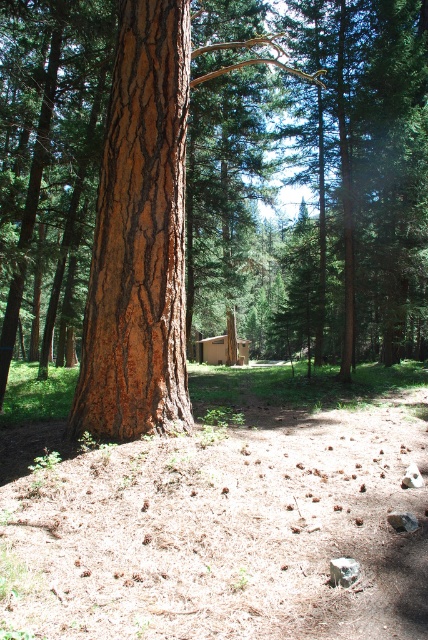
You are planning to build a small garden between the brown rough bark tree at center and the brown wooden cabin at center. Considering their sizes, which one will require more space to accommodate its base?

The brown rough bark tree at center is larger in size than the brown wooden cabin at center, so it will require more space to accommodate its base.

You are planning to build a small garden between the brown rough bark tree at center and the brown wooden cabin at center. Given that the tree is wider than the cabin, which object would require more space when placing garden elements around it?

The brown rough bark tree at center requires more space when placing garden elements around it because its width is larger than the brown wooden cabin at center.

You are planning to build a treehouse and need to know which object is taller between the brown rough bark tree at center and the brown wooden cabin at center. Can you determine which one is taller?

The brown rough bark tree at center is taller than the brown wooden cabin at center, so the tree is the better choice for building a treehouse.